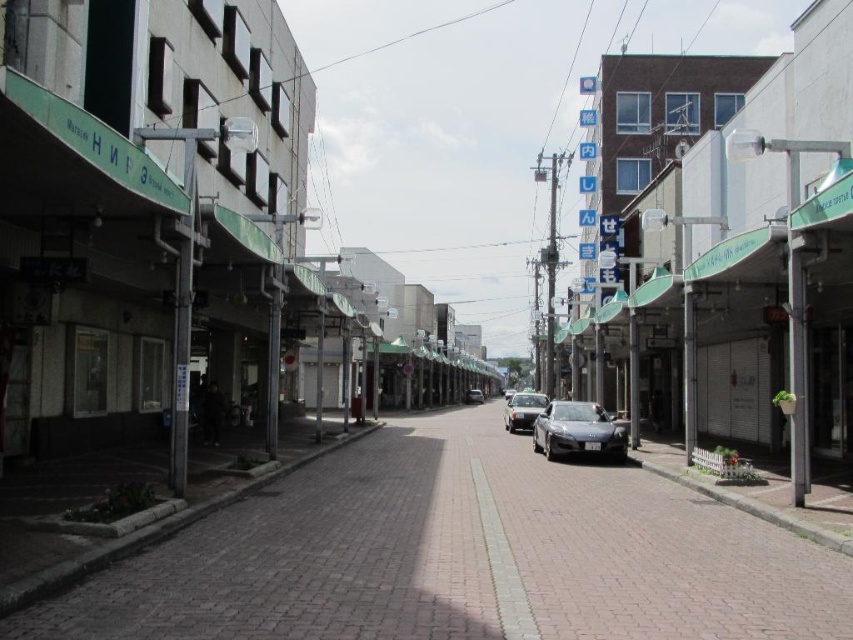
Question: Estimate the real-world distances between objects in this image. Which object is closer to the satin black car at center?

Choices:
 (A) shiny silver car at center
 (B) satin silver car at center
 (C) brick pavement at center

Answer: (A)

Question: Which of the following is the farthest from the observer?

Choices:
 (A) tap(674, 550)
 (B) tap(579, 406)
 (C) tap(519, 413)

Answer: (C)

Question: Which point appears farthest from the camera in this image?

Choices:
 (A) (126, 573)
 (B) (573, 404)
 (C) (471, 388)

Answer: (C)

Question: Is brick pavement at center in front of satin black car at center?

Choices:
 (A) yes
 (B) no

Answer: (A)

Question: Does satin black car at center have a greater width compared to satin silver car at center?

Choices:
 (A) yes
 (B) no

Answer: (A)

Question: Does satin black car at center have a lesser width compared to satin silver car at center?

Choices:
 (A) yes
 (B) no

Answer: (B)